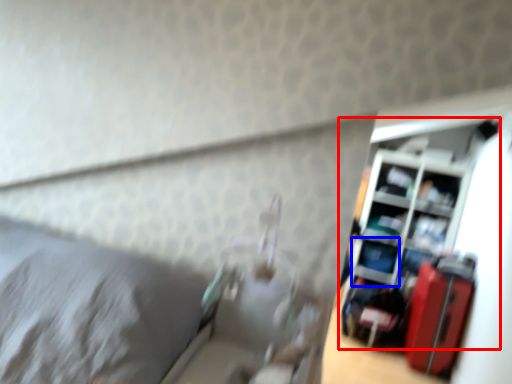
Question: Which object appears farthest to the camera in this image, shelf (highlighted by a red box) or shelf (highlighted by a blue box)?

Choices:
 (A) shelf
 (B) shelf

Answer: (B)